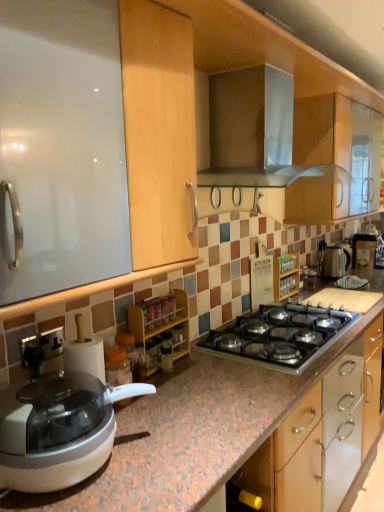
Question: Considering the relative sizes of metallic silver range hood at upper center, which ranks as the first kitchen appliance in top-to-bottom order, and white plastic food processor at lower left in the image provided, is metallic silver range hood at upper center, which ranks as the first kitchen appliance in top-to-bottom order, taller than white plastic food processor at lower left?

Choices:
 (A) yes
 (B) no

Answer: (A)

Question: Is metallic silver range hood at upper center, placed as the 1th kitchen appliance when sorted from front to back, oriented towards white plastic food processor at lower left?

Choices:
 (A) yes
 (B) no

Answer: (B)

Question: From a real-world perspective, is metallic silver range hood at upper center, which is the second kitchen appliance in right-to-left order, positioned under white plastic food processor at lower left based on gravity?

Choices:
 (A) no
 (B) yes

Answer: (A)

Question: Is metallic silver range hood at upper center, which is the second kitchen appliance in right-to-left order, closer to the viewer compared to white plastic food processor at lower left?

Choices:
 (A) yes
 (B) no

Answer: (B)

Question: Does metallic silver range hood at upper center, placed as the first kitchen appliance when sorted from left to right, lie behind white plastic food processor at lower left?

Choices:
 (A) yes
 (B) no

Answer: (A)

Question: Would you say satin silver kettle at right, acting as the first kitchen appliance starting from the back, is to the left or to the right of metallic silver range hood at upper center, placed as the 2th kitchen appliance when sorted from bottom to top, in the picture?

Choices:
 (A) left
 (B) right

Answer: (B)

Question: Choose the correct answer: Is satin silver kettle at right, acting as the first kitchen appliance starting from the back, inside metallic silver range hood at upper center, placed as the 1th kitchen appliance when sorted from front to back, or outside it?

Choices:
 (A) outside
 (B) inside

Answer: (A)

Question: Considering the positions of satin silver kettle at right, which appears as the 2th kitchen appliance when viewed from the top, and metallic silver range hood at upper center, placed as the first kitchen appliance when sorted from left to right, in the image, is satin silver kettle at right, which appears as the 2th kitchen appliance when viewed from the top, taller or shorter than metallic silver range hood at upper center, placed as the first kitchen appliance when sorted from left to right,?

Choices:
 (A) short
 (B) tall

Answer: (A)

Question: Considering the positions of satin silver kettle at right, which appears as the 2th kitchen appliance when viewed from the top, and metallic silver range hood at upper center, placed as the 1th kitchen appliance when sorted from front to back, in the image, is satin silver kettle at right, which appears as the 2th kitchen appliance when viewed from the top, wider or thinner than metallic silver range hood at upper center, placed as the 1th kitchen appliance when sorted from front to back,?

Choices:
 (A) wide
 (B) thin

Answer: (B)

Question: Based on their sizes in the image, would you say wooden spice rack at center, the 2th cabinetry when ordered from back to front, is bigger or smaller than metallic silver range hood at upper center, which ranks as the first kitchen appliance in top-to-bottom order?

Choices:
 (A) big
 (B) small

Answer: (B)

Question: From the image's perspective, is wooden spice rack at center, which is the 1th cabinetry from front to back, above or below metallic silver range hood at upper center, placed as the first kitchen appliance when sorted from left to right?

Choices:
 (A) below
 (B) above

Answer: (A)

Question: Visually, is wooden spice rack at center, the 2th cabinetry when ordered from back to front, positioned to the left or to the right of metallic silver range hood at upper center, which ranks as the first kitchen appliance in top-to-bottom order?

Choices:
 (A) right
 (B) left

Answer: (B)

Question: From a real-world perspective, is wooden spice rack at center, the 1th cabinetry in the left-to-right sequence, physically located above or below metallic silver range hood at upper center, which is the second kitchen appliance in right-to-left order?

Choices:
 (A) below
 (B) above

Answer: (A)

Question: Considering the positions of point (339, 261) and point (29, 425), is point (339, 261) closer or farther from the camera than point (29, 425)?

Choices:
 (A) closer
 (B) farther

Answer: (B)

Question: From their relative heights in the image, would you say satin silver kettle at right, arranged as the 1th kitchen appliance when ordered from the bottom, is taller or shorter than white plastic food processor at lower left?

Choices:
 (A) short
 (B) tall

Answer: (B)